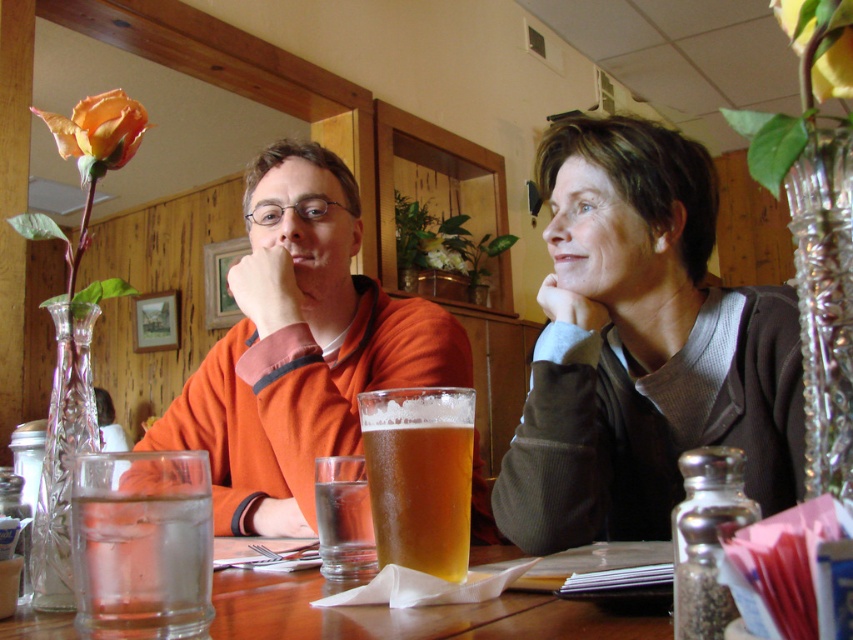
Is orange matte sweater at center bigger than clear glass beer at center?

Indeed, orange matte sweater at center has a larger size compared to clear glass beer at center.

Is orange matte sweater at center further to the viewer compared to clear glass beer at center?

That is True.

Between point (270, 512) and point (341, 496), which one is positioned in front?

Point (341, 496)

The image size is (853, 640). Find the location of `orange matte sweater at center`. orange matte sweater at center is located at coordinates (300, 348).

Can you confirm if matte orange sweater at center is smaller than dark brown sweater at upper right?

Indeed, matte orange sweater at center has a smaller size compared to dark brown sweater at upper right.

Between point (798, 483) and point (618, 141), which one is positioned in front?

Point (798, 483)

The height and width of the screenshot is (640, 853). I want to click on matte orange sweater at center, so click(x=642, y=346).

Does dark brown sweater at upper right have a larger size compared to orange matte sweater at center?

No.

Can you confirm if dark brown sweater at upper right is positioned to the right of orange matte sweater at center?

Indeed, dark brown sweater at upper right is positioned on the right side of orange matte sweater at center.

Which is behind, point (691, 413) or point (294, 476)?

The point (294, 476) is behind.

I want to click on dark brown sweater at upper right, so click(x=642, y=348).